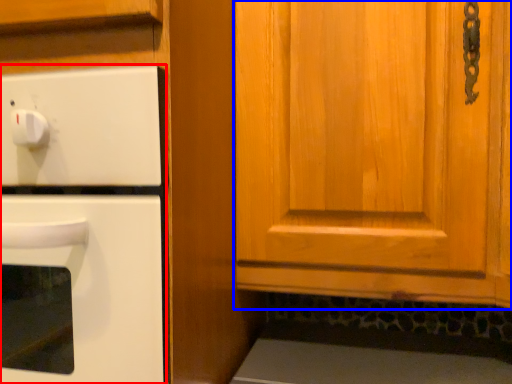
Question: Which object appears closest to the camera in this image, oven (highlighted by a red box) or cabinetry (highlighted by a blue box)?

Choices:
 (A) oven
 (B) cabinetry

Answer: (B)